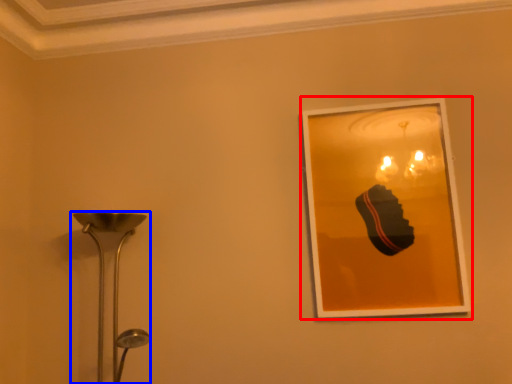
Question: Which of the following is the closest to the observer, picture frame (highlighted by a red box) or lamp (highlighted by a blue box)?

Choices:
 (A) picture frame
 (B) lamp

Answer: (B)